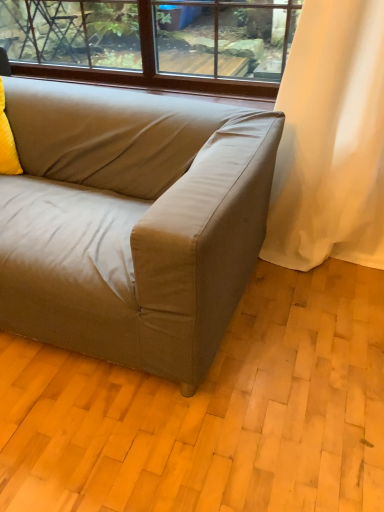
Question: In terms of size, does suede-like beige couch at center appear bigger or smaller than yellow fabric pillow at left?

Choices:
 (A) big
 (B) small

Answer: (A)

Question: Do you think suede-like beige couch at center is within yellow fabric pillow at left, or outside of it?

Choices:
 (A) outside
 (B) inside

Answer: (A)

Question: In the image, is suede-like beige couch at center on the left side or the right side of yellow fabric pillow at left?

Choices:
 (A) left
 (B) right

Answer: (B)

Question: Considering their positions, is yellow fabric pillow at left located in front of or behind suede-like beige couch at center?

Choices:
 (A) behind
 (B) front

Answer: (A)

Question: From a real-world perspective, is yellow fabric pillow at left positioned above or below suede-like beige couch at center?

Choices:
 (A) above
 (B) below

Answer: (A)

Question: Visually, is yellow fabric pillow at left positioned to the left or to the right of suede-like beige couch at center?

Choices:
 (A) left
 (B) right

Answer: (A)

Question: In terms of width, does yellow fabric pillow at left look wider or thinner when compared to suede-like beige couch at center?

Choices:
 (A) thin
 (B) wide

Answer: (A)